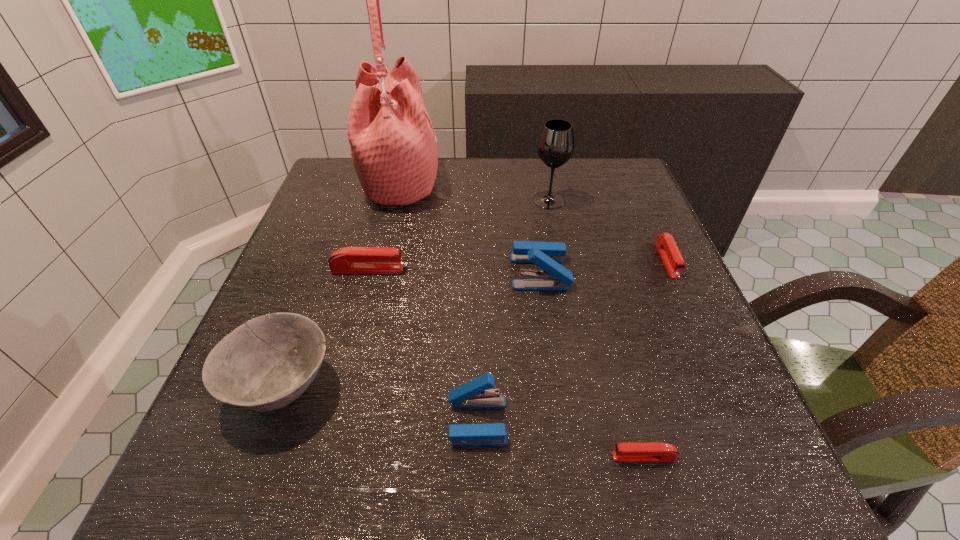
Locate an element on the screen. vacant space located on the front-facing side of the fourth tallest stapler is located at coordinates (750, 442).

The image size is (960, 540). In order to click on free space located 0.210m on the front-facing side of the nearest object in this screenshot , I will do `click(468, 457)`.

The height and width of the screenshot is (540, 960). Find the location of `free spot located on the front-facing side of the nearest object`. free spot located on the front-facing side of the nearest object is located at coordinates (578, 457).

Identify the location of free space located 0.340m on the front-facing side of the nearest object. The height and width of the screenshot is (540, 960). (379, 457).

This screenshot has height=540, width=960. I want to click on handbag that is at the far edge, so click(x=393, y=145).

Locate an element on the screen. This screenshot has width=960, height=540. wineglass that is at the far edge is located at coordinates (556, 143).

At what (x,y) coordinates should I click in order to perform the action: click on handbag that is at the left edge. Please return your answer as a coordinate pair (x, y). The height and width of the screenshot is (540, 960). Looking at the image, I should click on (393, 145).

Where is `bowl present at the left edge`? bowl present at the left edge is located at coordinates (265, 364).

Where is `stapler at the left edge`? Image resolution: width=960 pixels, height=540 pixels. stapler at the left edge is located at coordinates (349, 260).

Identify the location of object present at the far left corner. (393, 145).